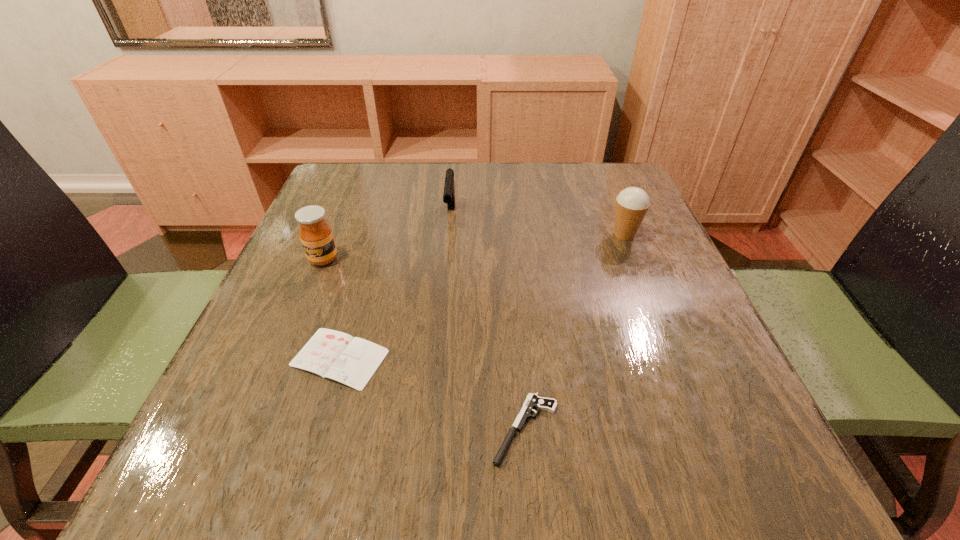
The image size is (960, 540). In order to click on free space at the near edge of the desktop in this screenshot , I will do `click(632, 458)`.

You are a GUI agent. You are given a task and a screenshot of the screen. Output one action in this format:
    pyautogui.click(x=<x>, y=<y>)
    Task: Click on the free location at the left edge of the desktop
    This screenshot has width=960, height=540.
    Given the screenshot: What is the action you would take?
    pyautogui.click(x=266, y=325)

Where is `vacant area at the right edge`? The image size is (960, 540). vacant area at the right edge is located at coordinates (678, 290).

This screenshot has width=960, height=540. In the image, there is a desktop. Find the location of `free space at the far left corner`. free space at the far left corner is located at coordinates (357, 205).

This screenshot has height=540, width=960. Identify the location of vacant space at the near left corner. (250, 461).

In the image, there is a desktop. Identify the location of vacant space at the far right corner. (603, 184).

Identify the location of vacant space at the near right corner of the desktop. The width and height of the screenshot is (960, 540). (714, 453).

Image resolution: width=960 pixels, height=540 pixels. I want to click on empty space that is in between the honey and the diary, so click(331, 308).

Locate an element on the screen. free space between the farther pistol and the nearer pistol is located at coordinates (488, 322).

The image size is (960, 540). Find the location of `free space between the third tallest object and the rightmost object`. free space between the third tallest object and the rightmost object is located at coordinates (538, 226).